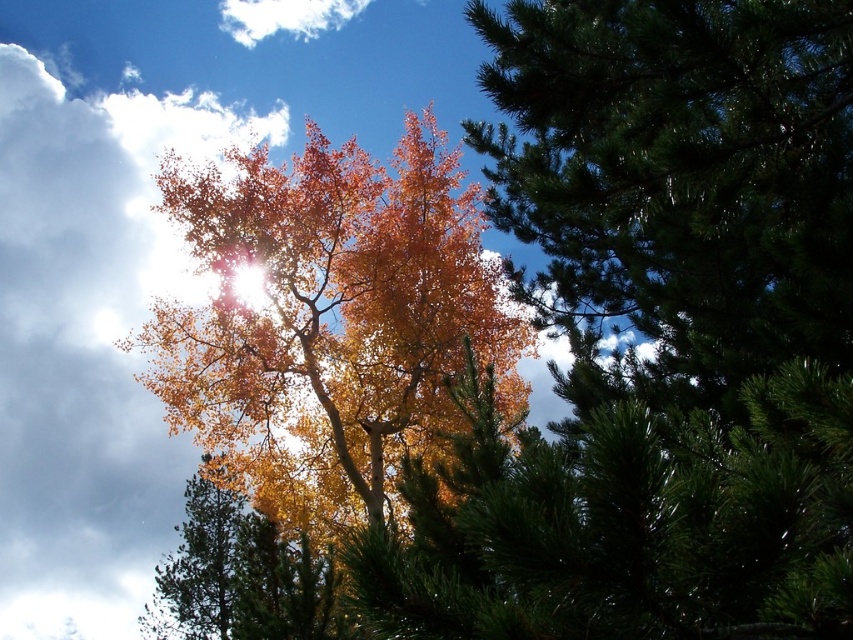
Does golden leaves at center have a greater height compared to white fluffy cloud at upper center?

In fact, golden leaves at center may be shorter than white fluffy cloud at upper center.

The height and width of the screenshot is (640, 853). What do you see at coordinates (329, 321) in the screenshot?
I see `golden leaves at center` at bounding box center [329, 321].

At what (x,y) coordinates should I click in order to perform the action: click on golden leaves at center. Please return your answer as a coordinate pair (x, y). The image size is (853, 640). Looking at the image, I should click on (329, 321).

Where is `golden leaves at center`? golden leaves at center is located at coordinates (329, 321).

Does point (227, 106) come farther from viewer compared to point (314, 29)?

That is False.

Is point (68, 442) positioned before point (300, 29)?

No, (68, 442) is behind (300, 29).

Does point (18, 134) come closer to viewer compared to point (248, 33)?

That is False.

Where is `white fluffy cloud at upper left`? white fluffy cloud at upper left is located at coordinates (88, 342).

Between golden leaves at center and white fluffy cloud at upper left, which one appears on the left side from the viewer's perspective?

white fluffy cloud at upper left

Is point (204, 243) positioned behind point (4, 221)?

No, (204, 243) is closer to viewer.

Locate an element on the screen. The image size is (853, 640). golden leaves at center is located at coordinates (329, 321).